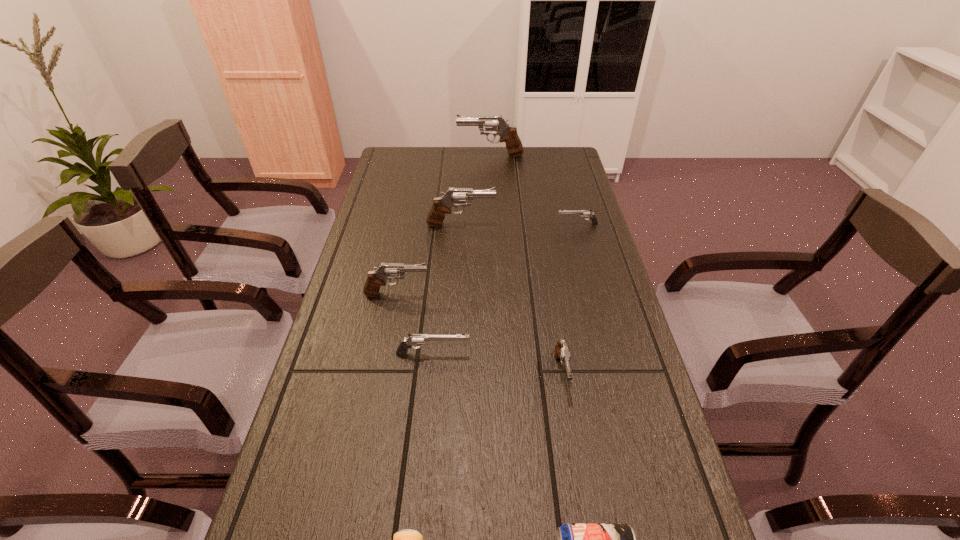
The width and height of the screenshot is (960, 540). Find the location of `free space between the third tallest pistol and the bigger silver pistol`. free space between the third tallest pistol and the bigger silver pistol is located at coordinates (415, 324).

Where is `free area in between the rightmost pistol and the fourth shortest pistol`? The image size is (960, 540). free area in between the rightmost pistol and the fourth shortest pistol is located at coordinates (487, 259).

Locate an element on the screen. Image resolution: width=960 pixels, height=540 pixels. vacant space in between the tallest pistol and the smallest gray pistol is located at coordinates (526, 264).

I want to click on blank region between the fifth tallest object and the third nearest gray pistol, so click(447, 289).

Where is `free space between the farthest object and the second smallest gray pistol`? The height and width of the screenshot is (540, 960). free space between the farthest object and the second smallest gray pistol is located at coordinates (444, 225).

Where is `object that is the second closest to the right silver pistol`? object that is the second closest to the right silver pistol is located at coordinates click(x=508, y=134).

Image resolution: width=960 pixels, height=540 pixels. I want to click on object that stands as the second closest to the right silver pistol, so click(x=508, y=134).

Locate an element on the screen. the fifth closest pistol to the third farthest gray pistol is located at coordinates (508, 134).

Identify which pistol is the fifth nearest to the farthest pistol. Please provide its 2D coordinates. Your answer should be formatted as a tuple, i.e. [(x, y)], where the tuple contains the x and y coordinates of a point satisfying the conditions above.

[(413, 339)]

Where is `gray pistol that is the nearest to the fifth pistol from left to right`? The height and width of the screenshot is (540, 960). gray pistol that is the nearest to the fifth pistol from left to right is located at coordinates (376, 278).